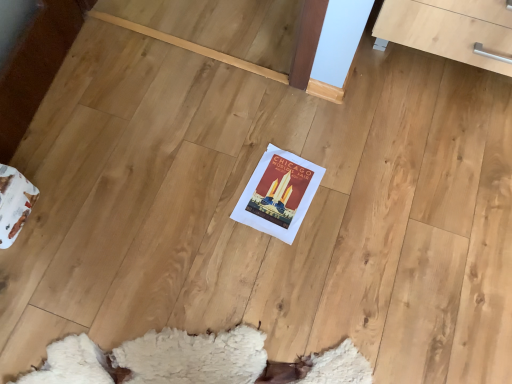
Where is `blank space to the left of white paper magazine at center`? The image size is (512, 384). blank space to the left of white paper magazine at center is located at coordinates (211, 183).